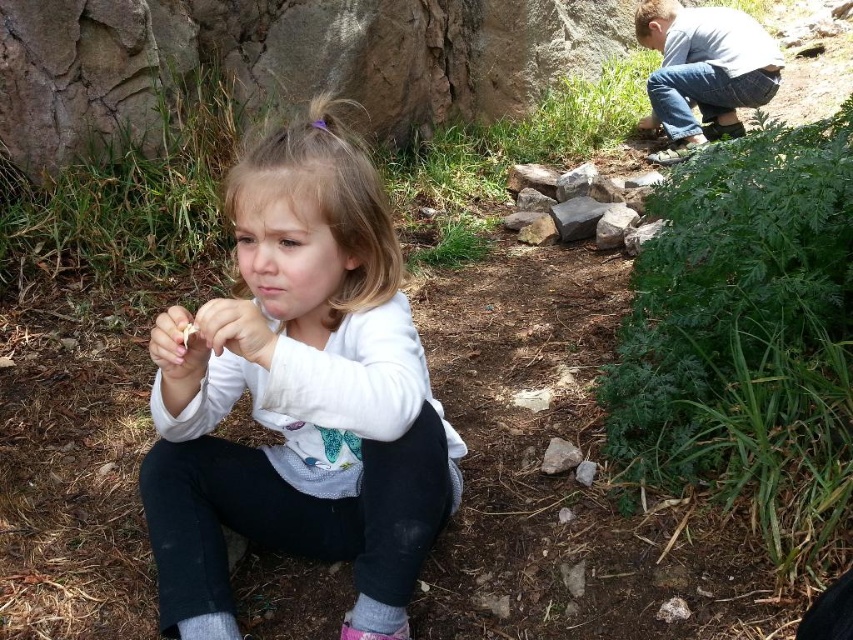
You are a parent looking for your child. You see the gray woolen sock at lower left and the pink matte lips at center. Which object is wider?

The gray woolen sock at lower left is wider than the pink matte lips at center.

You are a photographer trying to capture a closeup of the pink matte lips at center without including the gray woolen sock at lower left in the frame. Is this possible given their positions?

The gray woolen sock at lower left is further to the viewer than pink matte lips at center, so the sock is closer to the camera. This means the lips are behind the sock, making it impossible to capture the lips without the sock in the frame unless moving the camera position.

What is the color of the shirt worn by the child at the point with coordinates (703, 72)?

The point at coordinates (703, 72) corresponds to the light gray cotton shirt at upper right, so the shirt is light gray in color.